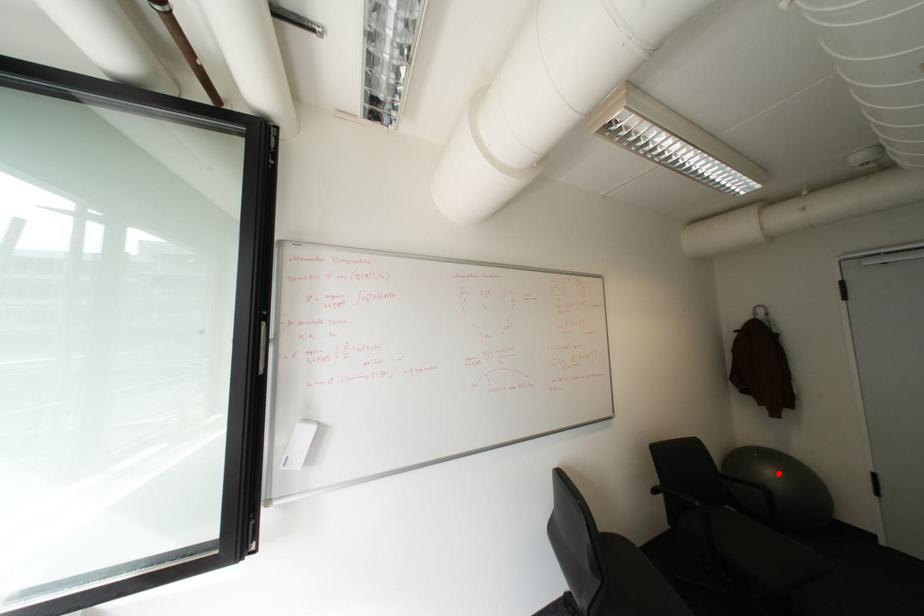
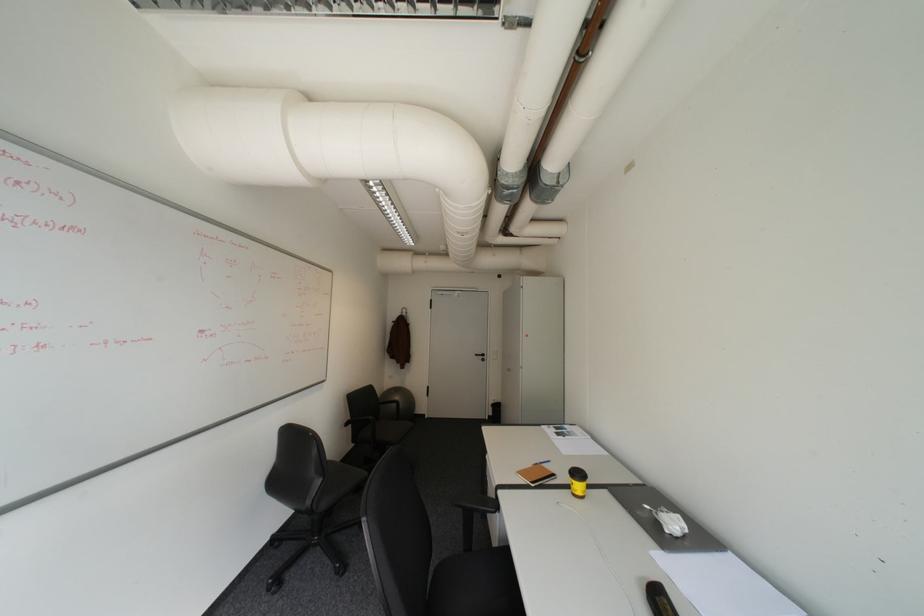
Where in the second image is the point corresponding to the highlighted location from the first image?

(407, 399)